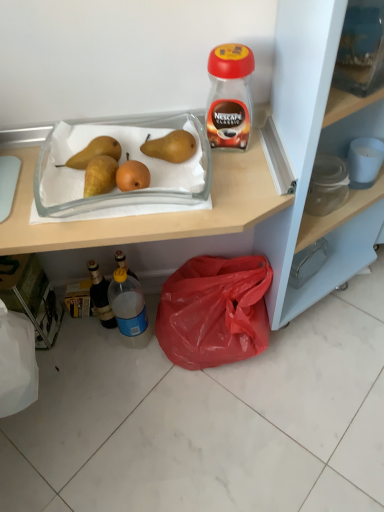
The image size is (384, 512). In order to click on vacant area that lies in front of translucent plastic bottle at lower left, acting as the first bottle starting from the right in this screenshot , I will do `click(135, 391)`.